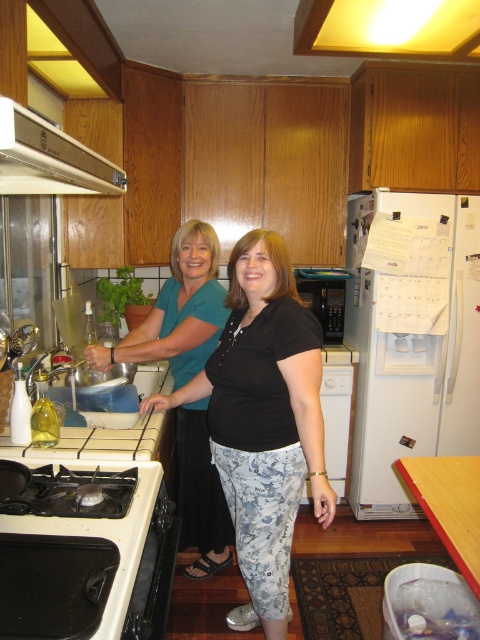
Can you confirm if white matte refrigerator at right is positioned below white glossy exhaust hood at upper left?

Yes, white matte refrigerator at right is below white glossy exhaust hood at upper left.

Locate an element on the screen. The height and width of the screenshot is (640, 480). white matte refrigerator at right is located at coordinates (411, 339).

Is the position of white matte refrigerator at right more distant than that of black cotton shirt at center?

Yes, white matte refrigerator at right is further from the viewer.

Is point (384, 300) farther from viewer compared to point (284, 627)?

That is True.

In order to click on white matte refrigerator at right in this screenshot , I will do `click(411, 339)`.

Is the position of black matte stove at lower left less distant than that of teal fabric shirt at center?

Yes, black matte stove at lower left is in front of teal fabric shirt at center.

Does black matte stove at lower left appear under teal fabric shirt at center?

Correct, black matte stove at lower left is located below teal fabric shirt at center.

Is point (96, 634) farther from camera compared to point (192, 458)?

No.

This screenshot has width=480, height=640. Identify the location of black matte stove at lower left. (84, 554).